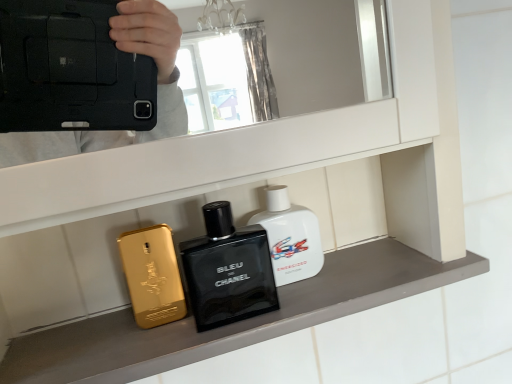
You are a GUI agent. You are given a task and a screenshot of the screen. Output one action in this format:
    pyautogui.click(x=<x>, y=<y>)
    Task: Click on the blank space above metallic gold phone at center (from a real-world perspective)
    This screenshot has width=512, height=384.
    Given the screenshot: What is the action you would take?
    pyautogui.click(x=241, y=301)